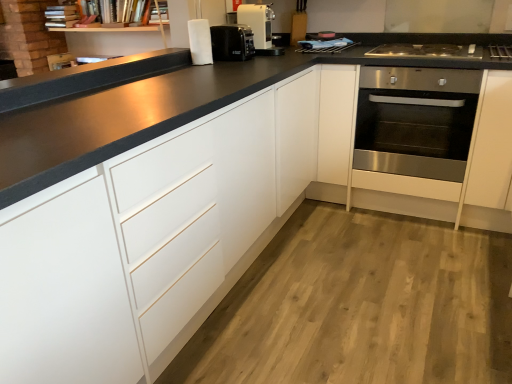
Question: From the image's perspective, would you say stainless steel gas stove at right is positioned over stainless steel oven at right?

Choices:
 (A) no
 (B) yes

Answer: (B)

Question: Is stainless steel gas stove at right closer to the viewer compared to stainless steel oven at right?

Choices:
 (A) yes
 (B) no

Answer: (B)

Question: Is stainless steel gas stove at right oriented away from stainless steel oven at right?

Choices:
 (A) yes
 (B) no

Answer: (A)

Question: Is stainless steel gas stove at right wider than stainless steel oven at right?

Choices:
 (A) yes
 (B) no

Answer: (B)

Question: Is stainless steel gas stove at right outside of stainless steel oven at right?

Choices:
 (A) no
 (B) yes

Answer: (A)

Question: Is stainless steel gas stove at right thinner than stainless steel oven at right?

Choices:
 (A) yes
 (B) no

Answer: (A)

Question: From the image's perspective, does stainless steel gas stove at right appear higher than white matte cabinet at left?

Choices:
 (A) yes
 (B) no

Answer: (A)

Question: From the image's perspective, is stainless steel gas stove at right below white matte cabinet at left?

Choices:
 (A) yes
 (B) no

Answer: (B)

Question: Does stainless steel gas stove at right touch white matte cabinet at left?

Choices:
 (A) yes
 (B) no

Answer: (B)

Question: Is stainless steel gas stove at right positioned far away from white matte cabinet at left?

Choices:
 (A) yes
 (B) no

Answer: (A)

Question: Is stainless steel gas stove at right further to the viewer compared to white matte cabinet at left?

Choices:
 (A) yes
 (B) no

Answer: (A)

Question: Is stainless steel gas stove at right at the left side of white matte cabinet at left?

Choices:
 (A) yes
 (B) no

Answer: (B)

Question: From the image's perspective, would you say stainless steel oven at right is shown under stainless steel gas stove at right?

Choices:
 (A) yes
 (B) no

Answer: (A)